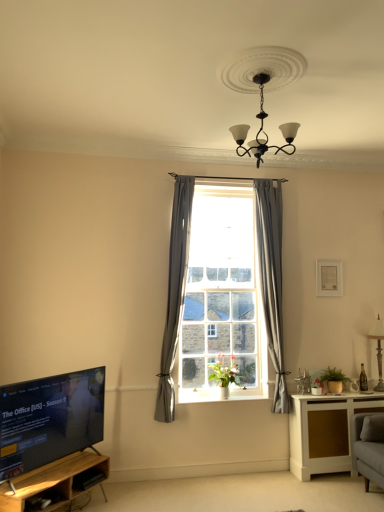
What do you see at coordinates (272, 280) in the screenshot? This screenshot has height=512, width=384. I see `gray fabric curtain at center, which ranks as the second curtain in left-to-right order` at bounding box center [272, 280].

The height and width of the screenshot is (512, 384). In order to click on white matte picture frame at upper right in this screenshot , I will do `click(329, 278)`.

Where is `matte black lamp at right`? matte black lamp at right is located at coordinates (378, 349).

Locate an element on the screen. The height and width of the screenshot is (512, 384). green matte vase at window, arranged as the first plant when viewed from the left is located at coordinates (225, 372).

Describe the element at coordinates (225, 372) in the screenshot. Image resolution: width=384 pixels, height=512 pixels. I see `green matte vase at window, positioned as the 2th plant in right-to-left order` at that location.

You are a GUI agent. You are given a task and a screenshot of the screen. Output one action in this format:
    pyautogui.click(x=<x>, y=<y>)
    Task: Click on the clear glass window at center
    
    Given the screenshot: What is the action you would take?
    pyautogui.click(x=272, y=280)

Is point (257, 202) positioned before point (334, 272)?

Yes, it is.

Is gray fabric curtain at center, the 1th curtain positioned from the right, not within white matte picture frame at upper right?

Absolutely, gray fabric curtain at center, the 1th curtain positioned from the right, is external to white matte picture frame at upper right.

Is gray fabric curtain at center, the 1th curtain positioned from the right, smaller than white matte picture frame at upper right?

Incorrect, gray fabric curtain at center, the 1th curtain positioned from the right, is not smaller in size than white matte picture frame at upper right.

Is white wood cabinet at lower right facing away from black glossy tv at lower left?

white wood cabinet at lower right does not have its back to black glossy tv at lower left.

Considering the sizes of objects white wood cabinet at lower right and black glossy tv at lower left in the image provided, who is thinner, white wood cabinet at lower right or black glossy tv at lower left?

black glossy tv at lower left.

Between white wood cabinet at lower right and black glossy tv at lower left, which one has larger size?

white wood cabinet at lower right is bigger.

Visually, is white wood cabinet at lower right positioned to the left or to the right of black glossy tv at lower left?

From the image, it's evident that white wood cabinet at lower right is to the right of black glossy tv at lower left.

Image resolution: width=384 pixels, height=512 pixels. Find the location of `window located behind the green matte vase at window, arranged as the first plant when viewed from the left`. window located behind the green matte vase at window, arranged as the first plant when viewed from the left is located at coordinates (272, 280).

Is point (217, 372) closer to viewer compared to point (271, 252)?

Yes, it is in front of point (271, 252).

Who is smaller, green matte vase at window, positioned as the 2th plant in right-to-left order, or clear glass window at center?

Smaller between the two is green matte vase at window, positioned as the 2th plant in right-to-left order.

Is point (374, 325) behind point (248, 398)?

Yes, point (374, 325) is farther from viewer.

Would you say matte black lamp at right is outside clear glass window sill at center?

Absolutely, matte black lamp at right is external to clear glass window sill at center.

From the picture: From the image's perspective, is matte black lamp at right located above clear glass window sill at center?

Yes, from the image's perspective, matte black lamp at right is above clear glass window sill at center.

Could you tell me if matte black lamp at right is turned towards clear glass window sill at center?

No, matte black lamp at right is not facing towards clear glass window sill at center.

From a real-world perspective, starting from the green matte vase at window, positioned as the 2th plant in right-to-left order, which curtain is the 2nd one vertically above it? Please provide its 2D coordinates.

[(272, 280)]

Based on the photo, from the image's perspective, is green matte vase at window, positioned as the 2th plant in right-to-left order, located beneath gray fabric curtain at center, the 1th curtain positioned from the right?

Indeed, from the image's perspective, green matte vase at window, positioned as the 2th plant in right-to-left order, is shown beneath gray fabric curtain at center, the 1th curtain positioned from the right.

Who is bigger, white matte picture frame at upper right or clear glass window at center?

clear glass window at center is bigger.

Which is less distant, (x=341, y=273) or (x=278, y=318)?

Point (x=278, y=318)

Does white matte picture frame at upper right have a lesser width compared to clear glass window at center?

Yes.

From the picture: Who is bigger, white wood cabinet at lower right or white matte picture frame at upper right?

white wood cabinet at lower right is bigger.

You are a GUI agent. You are given a task and a screenshot of the screen. Output one action in this format:
    pyautogui.click(x=<x>, y=<y>)
    Task: Click on the table in front of the white matte picture frame at upper right
    Image resolution: width=384 pixels, height=512 pixels.
    Given the screenshot: What is the action you would take?
    pyautogui.click(x=325, y=431)

Could white matte picture frame at upper right be considered to be inside white wood cabinet at lower right?

Actually, white matte picture frame at upper right is outside white wood cabinet at lower right.

Is white wood cabinet at lower right positioned far away from white matte picture frame at upper right?

Absolutely, white wood cabinet at lower right is distant from white matte picture frame at upper right.

Locate an element on the screen. This screenshot has width=384, height=512. curtain that is the 1st object located below the white matte picture frame at upper right (from the image's perspective) is located at coordinates (272, 280).

Where is `table that appears below the black glossy tv at lower left (from a real-world perspective)`? This screenshot has width=384, height=512. table that appears below the black glossy tv at lower left (from a real-world perspective) is located at coordinates (325, 431).

Based on their spatial positions, is green matte plant at right, placed as the 2th plant when sorted from left to right, or black wrought iron chandelier at upper center further from white wood cabinet at lower right?

black wrought iron chandelier at upper center.

When comparing their distances from clear glass window sill at center, does matte black lamp at right or black glossy tv at lower left seem closer?

Based on the image, black glossy tv at lower left appears to be nearer to clear glass window sill at center.

Which object lies further to the anchor point white wood cabinet at lower right, black glossy tv at lower left or white matte picture frame at upper right?

black glossy tv at lower left.

Considering their positions, is matte black lamp at right positioned further to black glossy tv at lower left than gray fabric curtain at center, positioned as the 2th curtain in right-to-left order?

Based on the image, matte black lamp at right appears to be further to black glossy tv at lower left.

Looking at this image, based on their spatial positions, is clear glass window at center or black wrought iron chandelier at upper center closer to gray fabric curtain at center, arranged as the 1th curtain when viewed from the left?

clear glass window at center lies closer to gray fabric curtain at center, arranged as the 1th curtain when viewed from the left, than the other object.

When comparing their distances from matte black lamp at right, does white wood cabinet at lower right or clear glass window at center seem closer?

Based on the image, white wood cabinet at lower right appears to be nearer to matte black lamp at right.

From the image, which object appears to be farther from clear glass window sill at center, black glossy tv at lower left or white wood cabinet at lower right?

black glossy tv at lower left lies further to clear glass window sill at center than the other object.

From the image, which object appears to be farther from black glossy tv at lower left, wooden at left or clear glass window at center?

The object further to black glossy tv at lower left is clear glass window at center.

Identify the location of window sill between wooden at left and gray fabric curtain at center, which ranks as the second curtain in left-to-right order. (198, 394).

You are a GUI agent. You are given a task and a screenshot of the screen. Output one action in this format:
    pyautogui.click(x=<x>, y=<y>)
    Task: Click on the lamp that lies between black wrought iron chandelier at upper center and white wood cabinet at lower right from top to bottom
    The image size is (384, 512).
    Given the screenshot: What is the action you would take?
    pyautogui.click(x=378, y=349)

In order to click on window between gray fabric curtain at center, positioned as the 2th curtain in right-to-left order, and clear glass window sill at center in the up-down direction in this screenshot , I will do `click(272, 280)`.

The width and height of the screenshot is (384, 512). In order to click on shelf between black glossy tv at lower left and matte black lamp at right in the horizontal direction in this screenshot , I will do click(x=55, y=482).